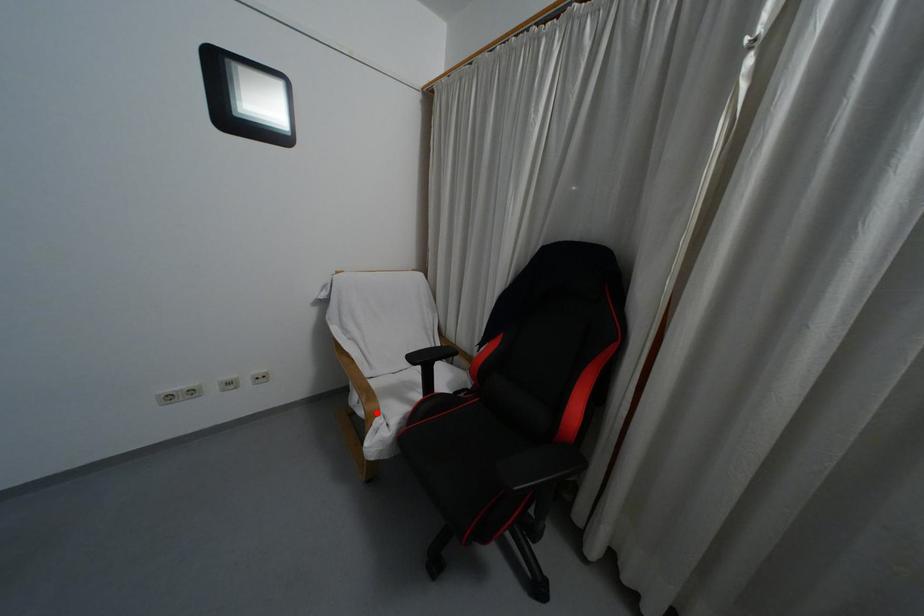
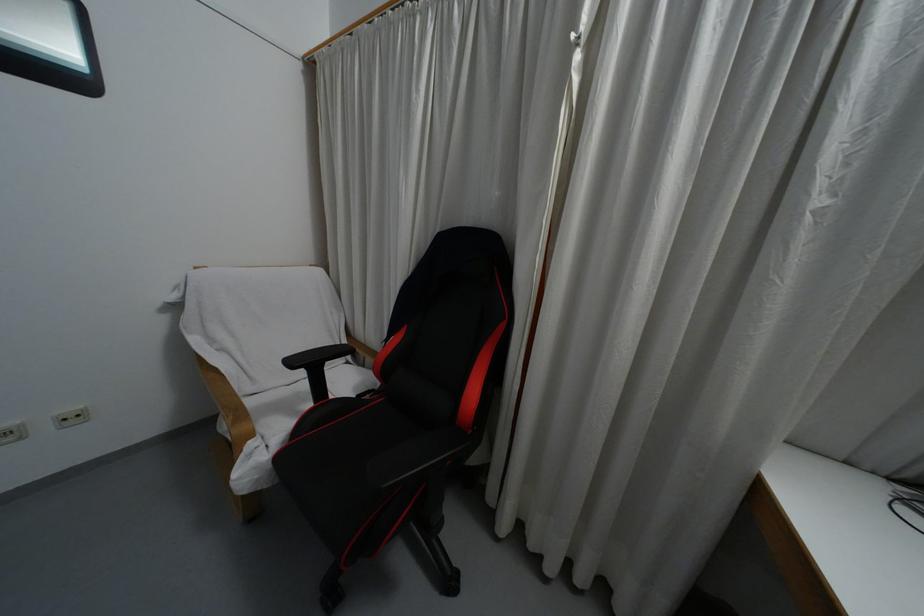
Question: I am providing you with two images of the same scene from different viewpoints. Image1 has a red point marked. In image2, the corresponding 3D location appears at what relative position? Reply with the corresponding letter.

Choices:
 (A) Closer
 (B) Farther

Answer: (A)